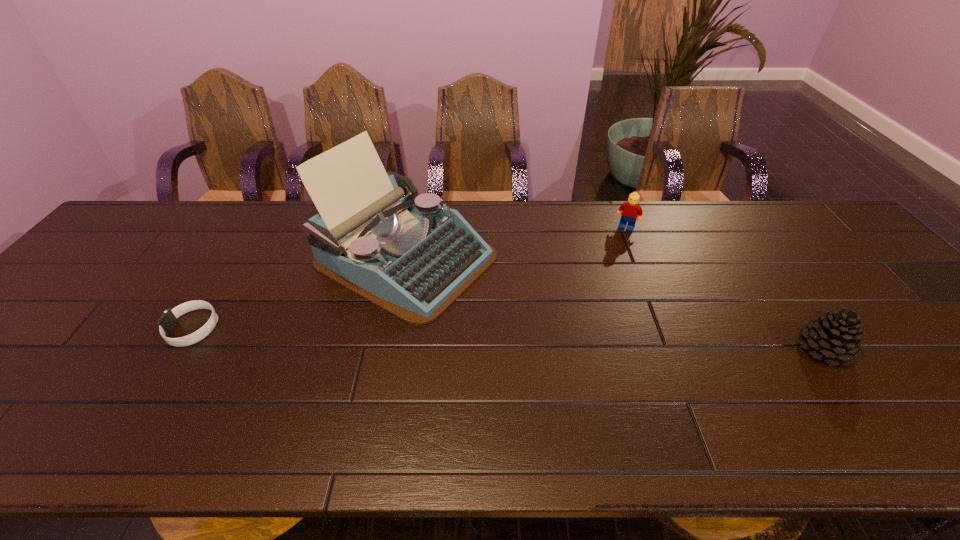
In the image, there is a desktop. Where is `blank space at the far edge`? The height and width of the screenshot is (540, 960). blank space at the far edge is located at coordinates (524, 238).

Locate an element on the screen. The image size is (960, 540). vacant space at the near edge of the desktop is located at coordinates (395, 401).

Locate an element on the screen. The width and height of the screenshot is (960, 540). vacant space at the right edge of the desktop is located at coordinates (863, 298).

In the image, there is a desktop. Where is `vacant space at the far left corner`? vacant space at the far left corner is located at coordinates (122, 244).

At what (x,y) coordinates should I click in order to perform the action: click on vacant space at the far right corner of the desktop. Please return your answer as a coordinate pair (x, y). This screenshot has width=960, height=540. Looking at the image, I should click on (766, 201).

The width and height of the screenshot is (960, 540). Find the location of `vacant space at the near right corner of the desktop`. vacant space at the near right corner of the desktop is located at coordinates (951, 379).

Where is `empty location between the typewriter and the wristband`? The height and width of the screenshot is (540, 960). empty location between the typewriter and the wristband is located at coordinates (300, 293).

Locate an element on the screen. The height and width of the screenshot is (540, 960). vacant point located between the pinecone and the leftmost object is located at coordinates (508, 339).

Identify the location of vacant point located between the third object from right to left and the shortest object. Image resolution: width=960 pixels, height=540 pixels. (300, 293).

Locate an element on the screen. The height and width of the screenshot is (540, 960). free spot between the tallest object and the pinecone is located at coordinates (614, 303).